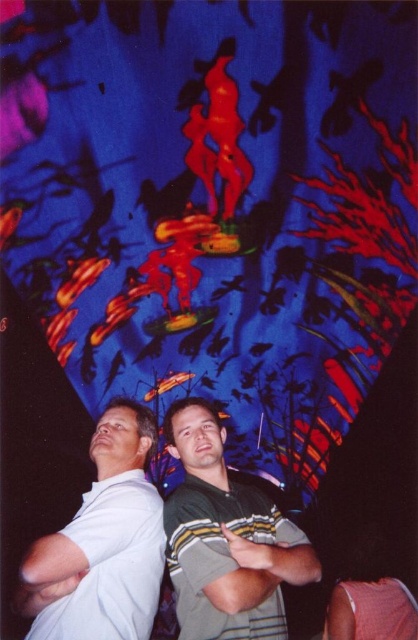
Question: Can you confirm if green striped shirt at center is bigger than white cotton shirt at left?

Choices:
 (A) no
 (B) yes

Answer: (B)

Question: Does green striped shirt at center appear on the right side of white cotton shirt at left?

Choices:
 (A) yes
 (B) no

Answer: (A)

Question: Among these objects, which one is nearest to the camera?

Choices:
 (A) white cotton shirt at left
 (B) green striped shirt at center

Answer: (A)

Question: Which point is closer to the camera?

Choices:
 (A) white cotton shirt at left
 (B) green striped shirt at center

Answer: (A)

Question: Can you confirm if green striped shirt at center is bigger than white cotton shirt at left?

Choices:
 (A) yes
 (B) no

Answer: (A)